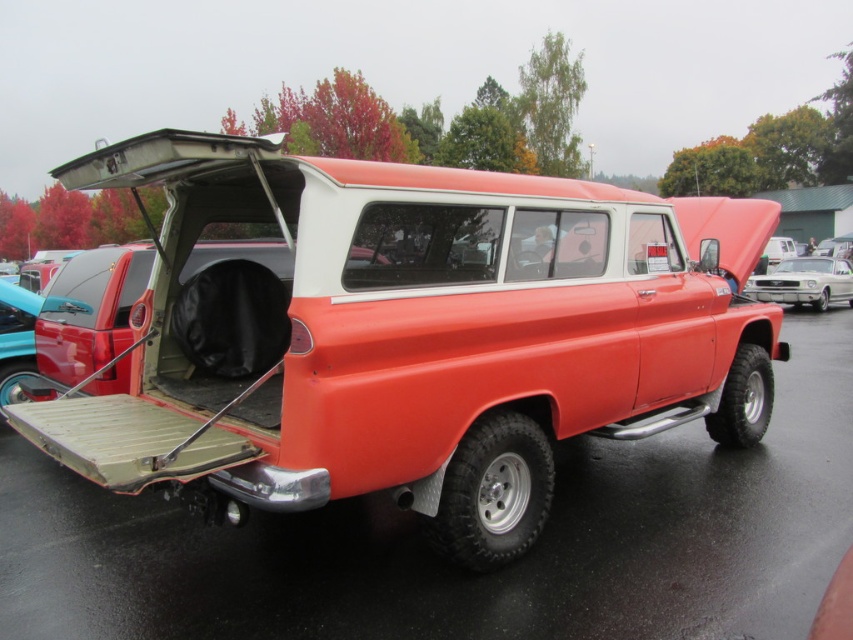
Question: Does matte orange truck at center come behind metallic silver car at right?

Choices:
 (A) yes
 (B) no

Answer: (B)

Question: Can you confirm if matte orange truck at center is wider than metallic silver car at right?

Choices:
 (A) yes
 (B) no

Answer: (B)

Question: Can you confirm if matte orange truck at center is bigger than metallic silver car at right?

Choices:
 (A) yes
 (B) no

Answer: (B)

Question: Which point is closer to the camera?

Choices:
 (A) (821, 289)
 (B) (682, 348)

Answer: (B)

Question: Which object appears farthest from the camera in this image?

Choices:
 (A) matte orange truck at center
 (B) metallic silver car at right

Answer: (B)

Question: Which point is closer to the camera?

Choices:
 (A) (433, 195)
 (B) (763, 296)

Answer: (A)